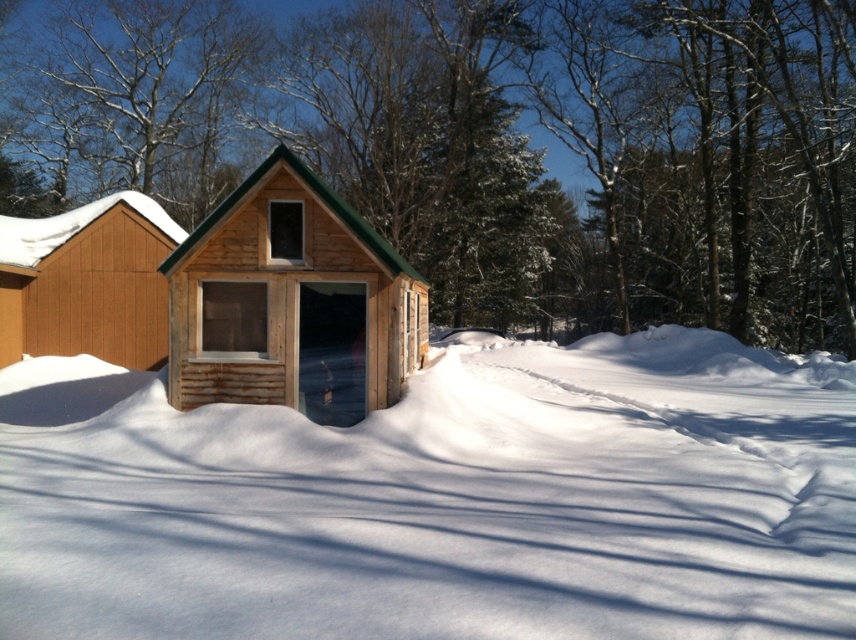
You are planning to build a snowman using the white fluffy snow at center near the brown wood cabin at left. Considering the height of the snow, will you have enough snow to build a tall snowman?

The white fluffy snow at center has a lesser height compared to brown wood cabin at left. Therefore, there might not be enough snow to build a tall snowman since the snow is not as high as the cabin.

You are an observer standing in front of the shed. You notice the white fluffy snow at center and the bare branches at upper center. Which object is located below the other?

The white fluffy snow at center is positioned under the bare branches at upper center.

You are standing in the snowy landscape and want to walk from the bare branches at upper center to the brown wood cabin at left. Which direction should you move to get closer to the cabin?

You should move away from the bare branches at upper center towards the brown wood cabin at left since the cabin is further away from you compared to the branches.